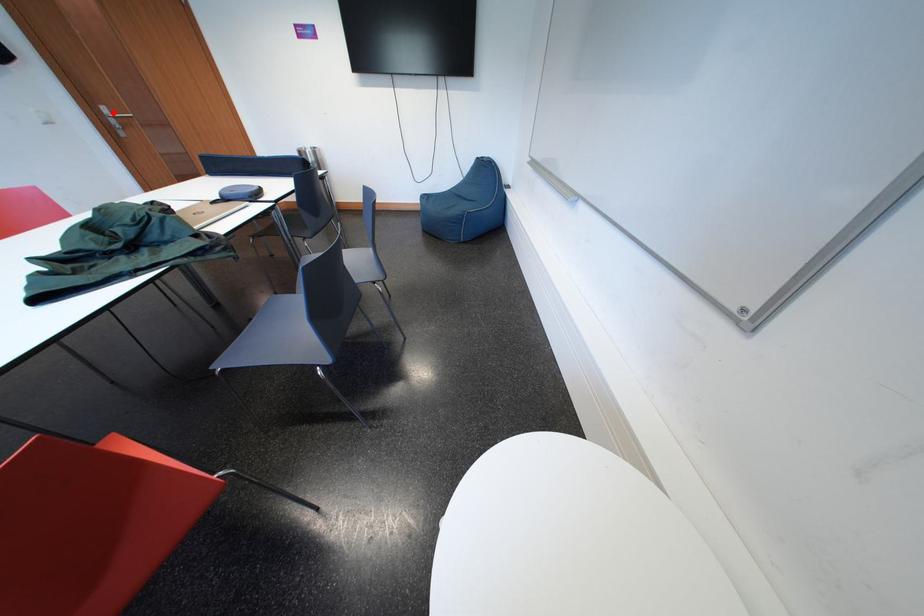
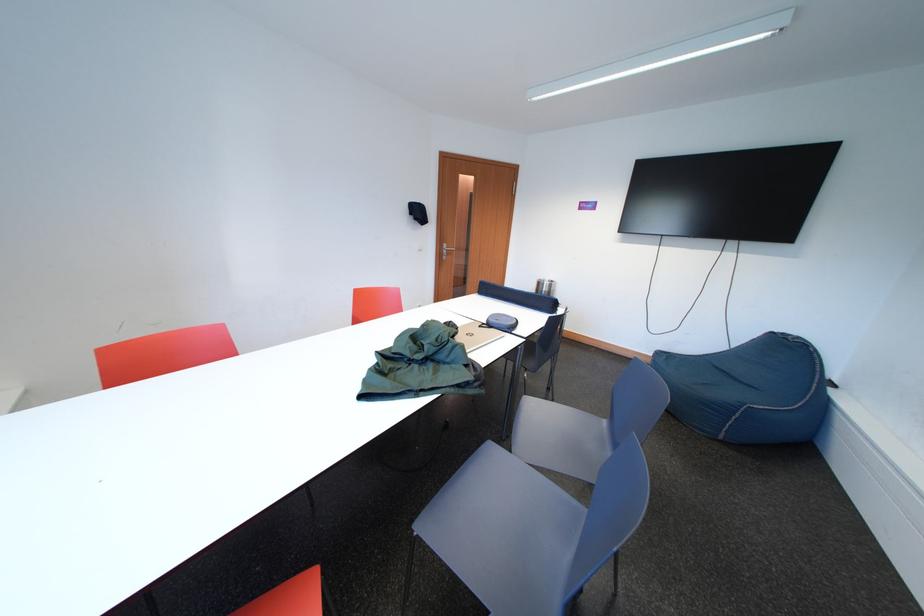
Question: I am providing you with two images of the same scene from different viewpoints. A red point is shown in image1. For the corresponding object point in image2, is it positioned nearer or farther from the camera?

Choices:
 (A) Nearer
 (B) Farther

Answer: (A)